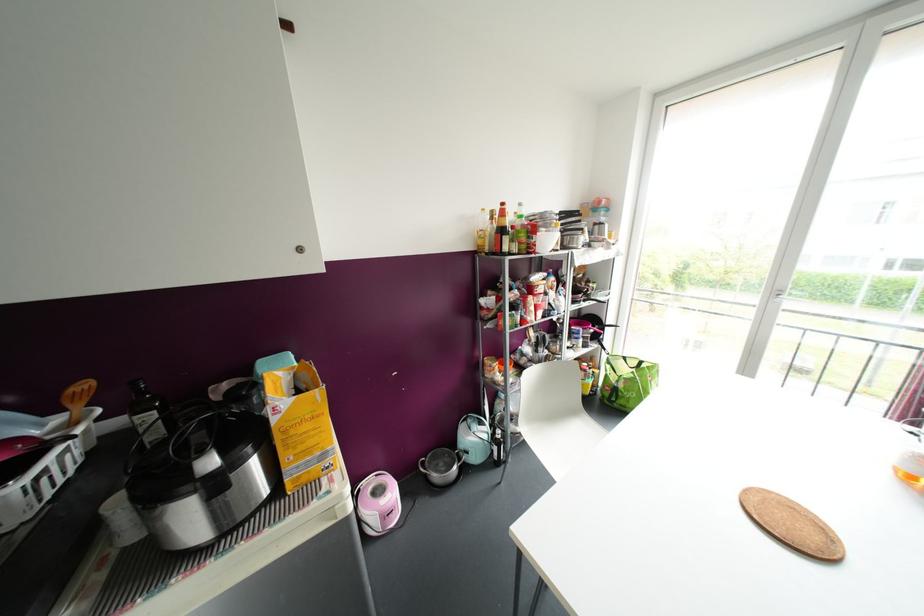
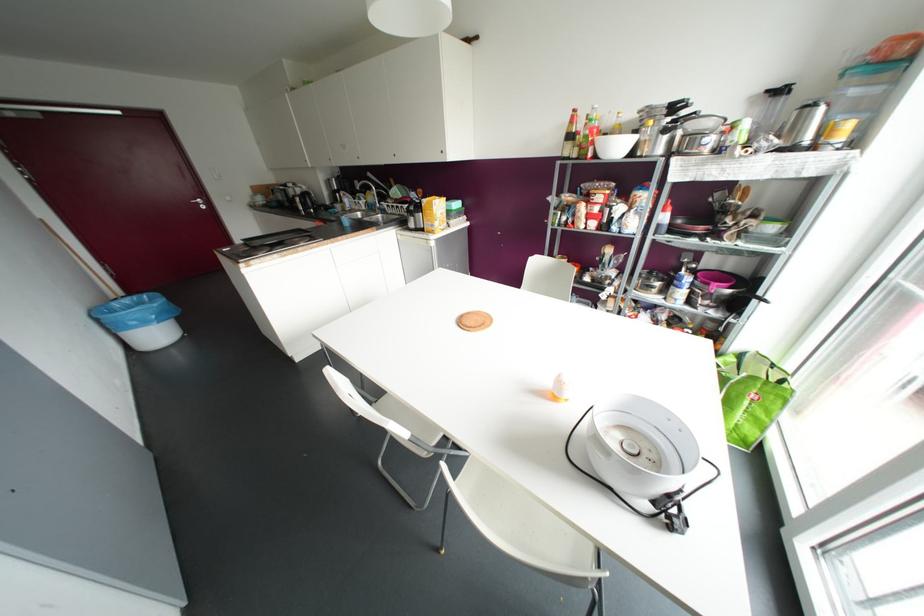
Where in the second image is the point corresponding to the point at 274,419 from the first image?

(421, 204)